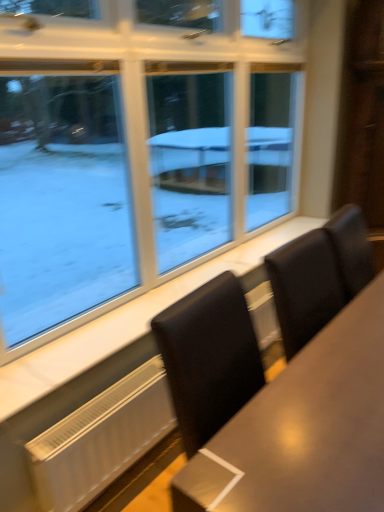
Question: From the image's perspective, is white matte radiator at lower left located above or below white marble window sill at lower center?

Choices:
 (A) below
 (B) above

Answer: (A)

Question: Is white matte radiator at lower left in front of or behind white marble window sill at lower center in the image?

Choices:
 (A) front
 (B) behind

Answer: (B)

Question: Estimate the real-world distances between objects in this image. Which object is farther from the white marble window sill at lower center?

Choices:
 (A) matte brown table at center
 (B) clear glass window at upper left
 (C) white matte radiator at lower left

Answer: (A)

Question: Considering the real-world distances, which object is closest to the white marble window sill at lower center?

Choices:
 (A) clear glass window at upper left
 (B) matte brown table at center
 (C) white matte radiator at lower left

Answer: (C)